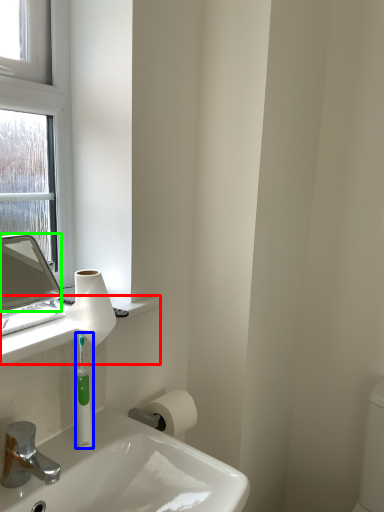
Question: Considering the real-world distances, which object is closest to counter top (highlighted by a red box)? mouthwash (highlighted by a blue box) or mirror (highlighted by a green box).

Choices:
 (A) mouthwash
 (B) mirror

Answer: (A)